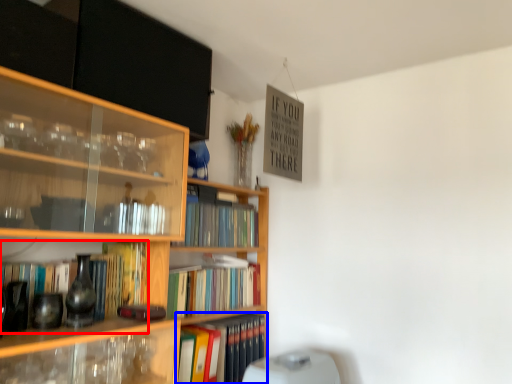
Question: Among these objects, which one is farthest to the camera, book (highlighted by a red box) or book (highlighted by a blue box)?

Choices:
 (A) book
 (B) book

Answer: (B)